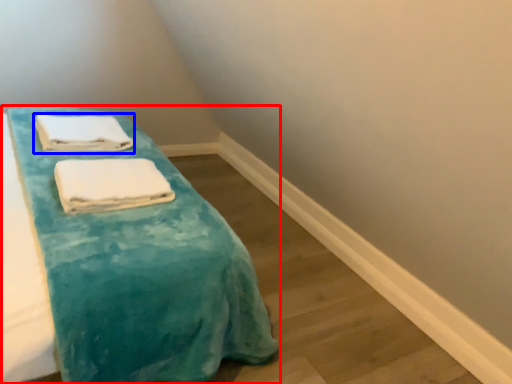
Question: Which object is closer to the camera taking this photo, furniture (highlighted by a red box) or towel (highlighted by a blue box)?

Choices:
 (A) furniture
 (B) towel

Answer: (A)